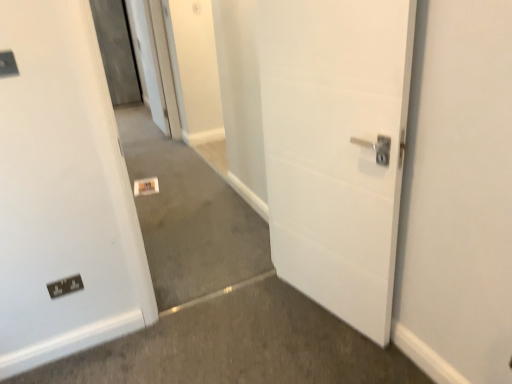
Question: Is point (8, 71) closer or farther from the camera than point (49, 284)?

Choices:
 (A) farther
 (B) closer

Answer: (B)

Question: In terms of width, does matte black switch at upper left look wider or thinner when compared to black plastic electric outlet at lower left?

Choices:
 (A) wide
 (B) thin

Answer: (A)

Question: Which of these objects is positioned farthest from the black plastic electric outlet at lower left?

Choices:
 (A) matte black switch at upper left
 (B) neutral carpet at center

Answer: (B)

Question: Which of these objects is positioned farthest from the black plastic electric outlet at lower left?

Choices:
 (A) neutral carpet at center
 (B) matte black switch at upper left

Answer: (A)